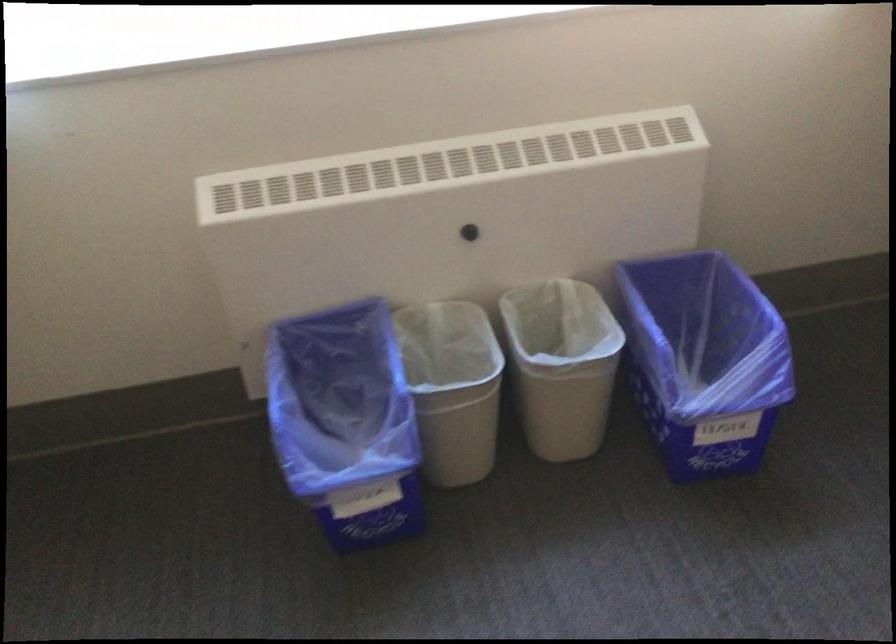
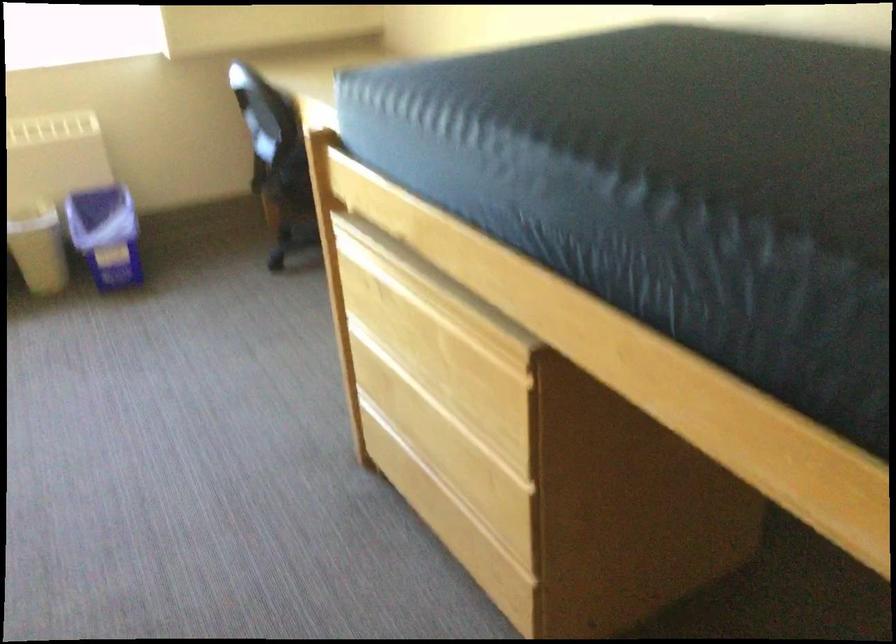
In a continuous first-person perspective shot, in which direction is the camera moving?

The movement direction of the cameraman is right, backward.